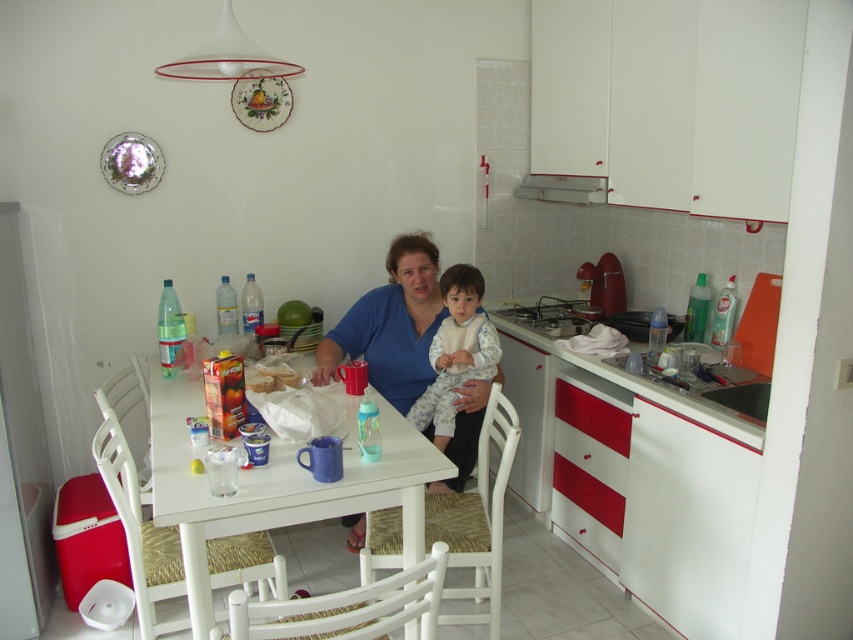
You are a guest in this kitchen and need to place a small plate on the table. Given that the white glossy table at center and the fluffy white pajamas at center are both at the center, which object should you place the plate on?

You should place the plate on the white glossy table at center because it is larger in size than the fluffy white pajamas at center.

You are standing in the kitchen and want to reach both the point at coordinates (434,275) and the point at coordinates (442,364). Which point is closer to you?

Point (434,275) is closer to you because it is further to the camera than point (442,364), meaning it is nearer in the scene.

You are standing in the kitchen and want to place a plate on the white glossy table at center. However, there is a blue fabric shirt at center in your way. Which object should you move first to reach the table?

The blue fabric shirt at center is closer to you than the white glossy table at center, so you should move the blue fabric shirt at center first to reach the table.